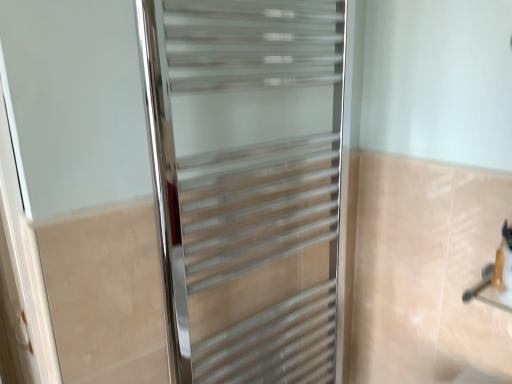
Identify the location of polished chrome towel rack at center. This screenshot has height=384, width=512. (206, 162).

This screenshot has width=512, height=384. Describe the element at coordinates (206, 162) in the screenshot. I see `polished chrome towel rack at center` at that location.

This screenshot has height=384, width=512. Identify the location of polished chrome towel rack at center. (206, 162).